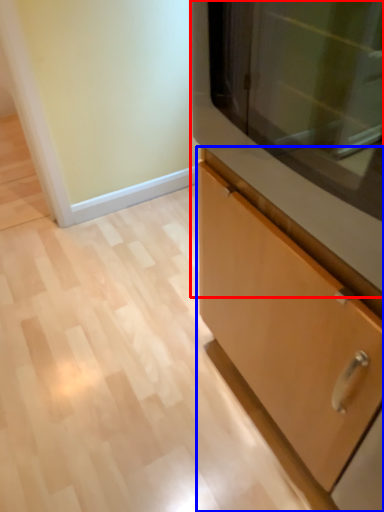
Question: Which point is closer to the camera, microwave (highlighted by a red box) or cabinetry (highlighted by a blue box)?

Choices:
 (A) microwave
 (B) cabinetry

Answer: (B)